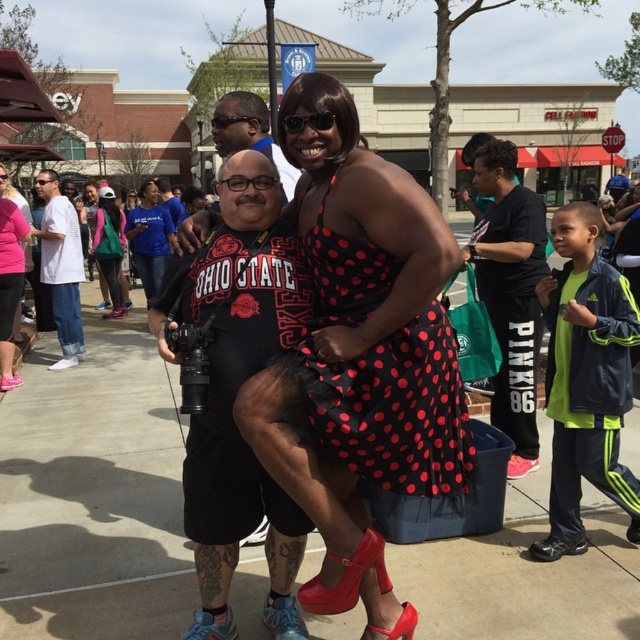
Between polka dot dress at center and shiny patent leather high-heeled shoe at center, which one appears on the left side from the viewer's perspective?

shiny patent leather high-heeled shoe at center

Which is above, polka dot dress at center or shiny patent leather high-heeled shoe at center?

Positioned higher is polka dot dress at center.

Who is more forward, (352, 406) or (308, 593)?

Positioned in front is point (352, 406).

Find the location of a particular element. This screenshot has width=640, height=640. polka dot dress at center is located at coordinates (360, 332).

Does point (595, 330) come closer to viewer compared to point (129, 307)?

Yes, point (595, 330) is in front of point (129, 307).

Between neon green fleece at right and brushed metal shoe at center, which one is positioned lower?

neon green fleece at right is lower down.

Measure the distance between point [541,291] and camera.

Point [541,291] and camera are 3.12 meters apart.

Locate an element on the screen. This screenshot has width=640, height=640. neon green fleece at right is located at coordinates (586, 371).

Is black matte t-shirt at center further to camera compared to matte black camera at center?

No, black matte t-shirt at center is closer to the viewer.

Who is more distant from viewer, (237, 314) or (115, 317)?

Positioned behind is point (115, 317).

Where is `black matte t-shirt at center`? black matte t-shirt at center is located at coordinates (236, 372).